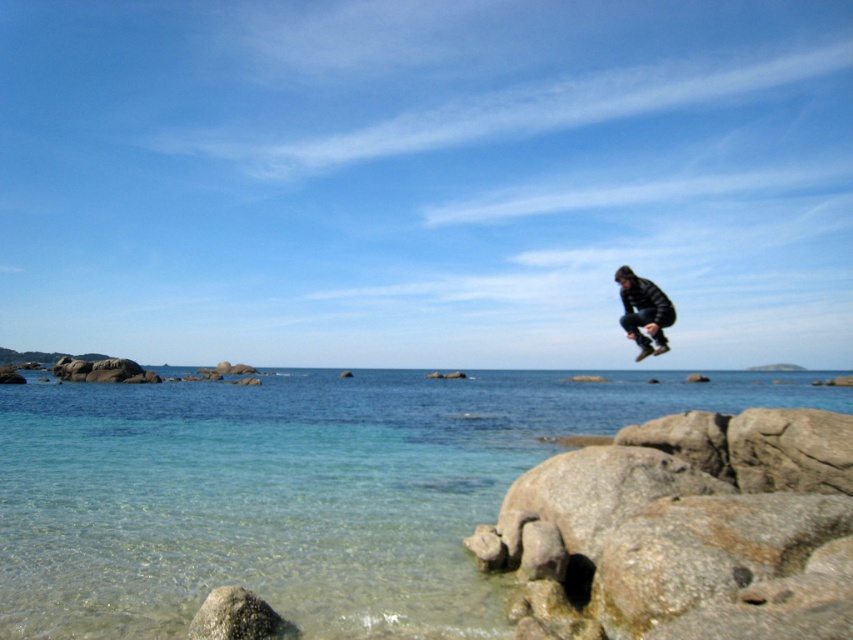
Based on the photo, you are standing on the shore and notice the clear water at lower left and the gray rock at lower left. Which one appears taller from your viewpoint?

The clear water at lower left appears taller than the gray rock at lower left from your viewpoint.

You are standing at the center of the rocky shoreline and want to find the clear water at lower left. According to the coordinates provided, in which direction should you move to reach it?

The clear water at lower left is located at point [297,490], which means it is positioned to the lower left from your current position at the center. Move towards the lower left direction to reach it.